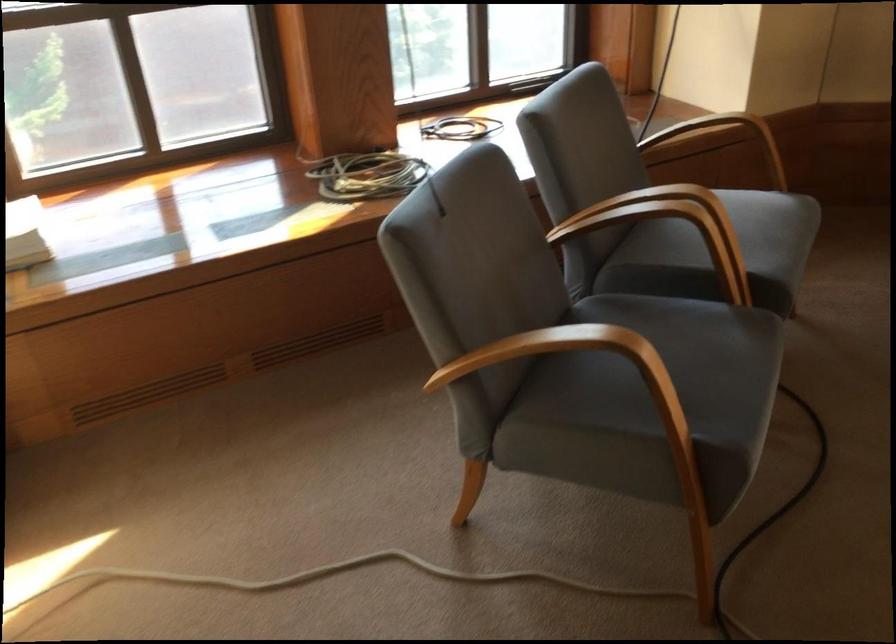
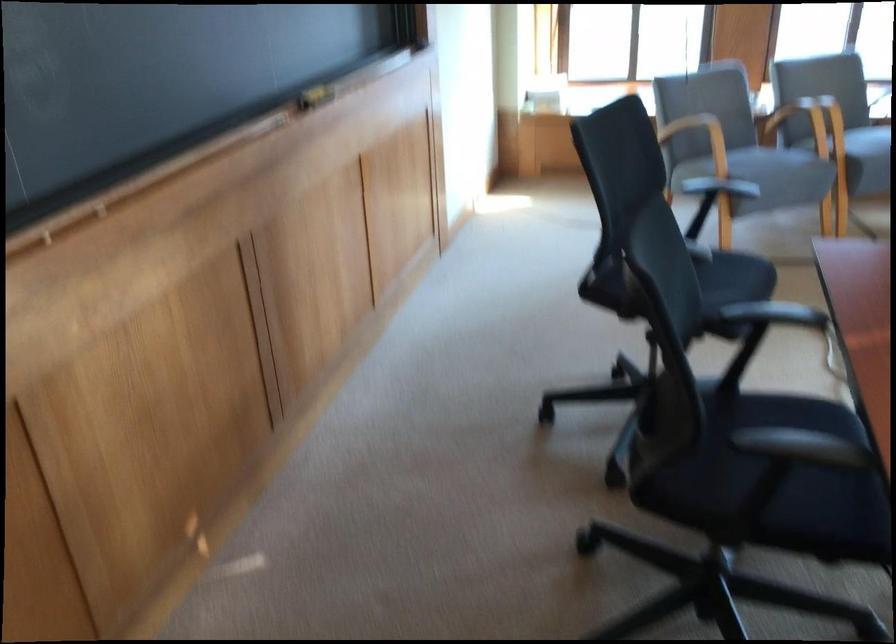
Where in the second image is the point corresponding to (x=635, y=268) from the first image?

(799, 122)